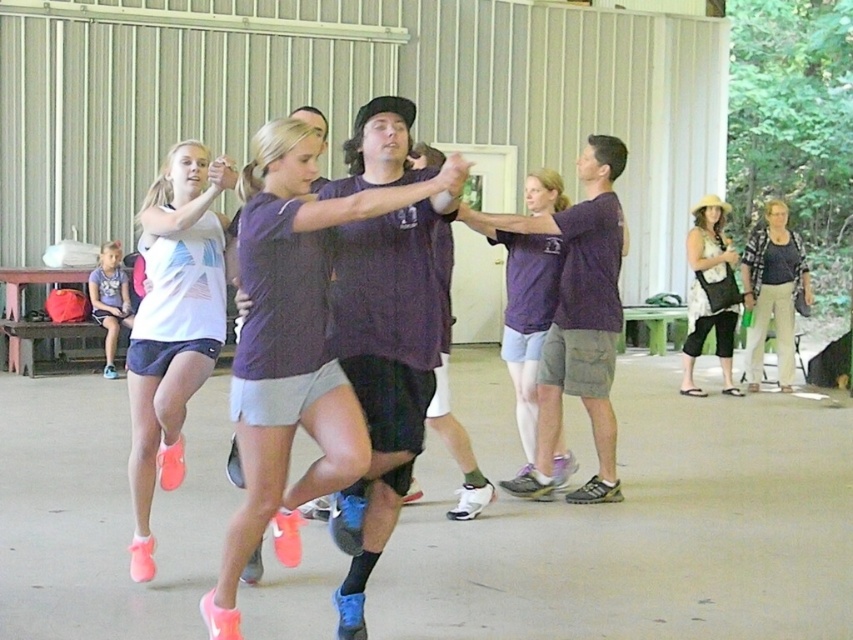
You are a photographer standing at the back of the gym. You need to take a photo that includes both the pink matte shorts at center and the dark blue shirt at right. Given that your camera has a maximum zoom range of 5 meters, will you be able to capture both objects in the same frame without moving closer?

The pink matte shorts at center and dark blue shirt at right are 7.62 meters apart from each other. Since the camera can only zoom up to 5 meters, the distance between them exceeds the camera range. Therefore, you won cannot capture both in the same frame without moving closer.